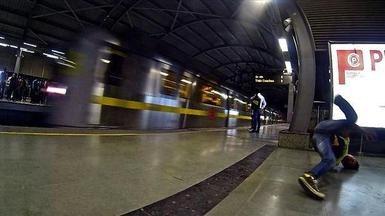
Find the location of `gray floor`. gray floor is located at coordinates (115, 165), (290, 201).